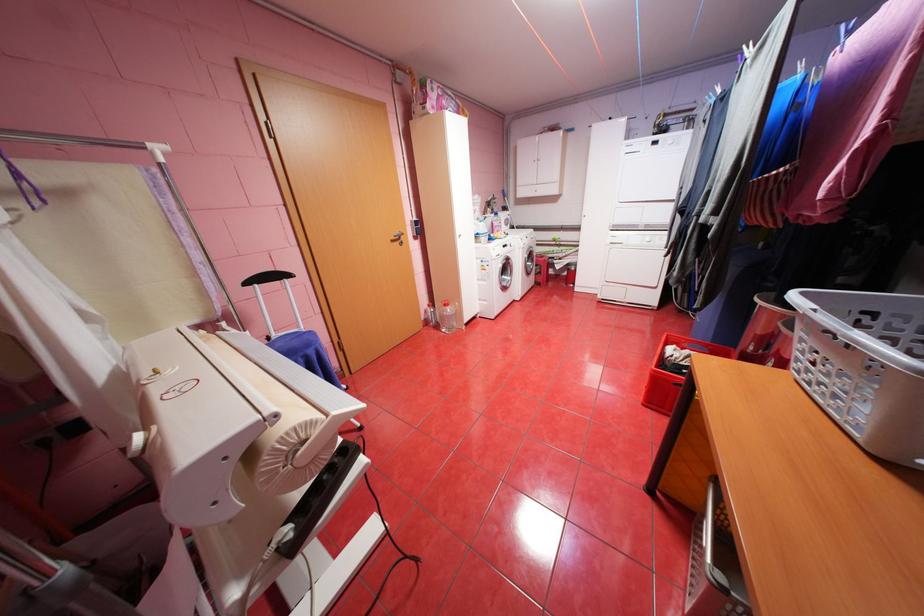
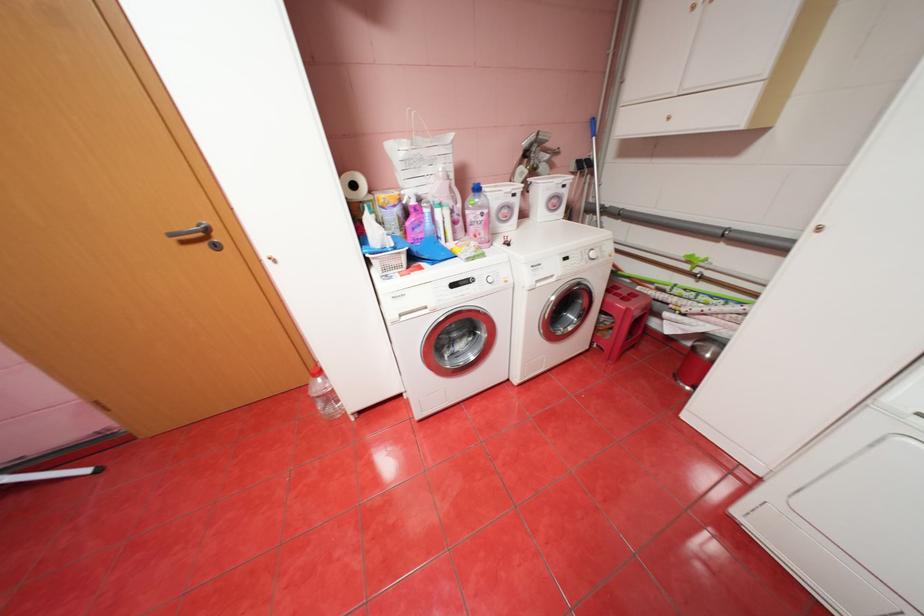
In the second image, find the point that corresponds to point 407,243 in the first image.

(213, 245)